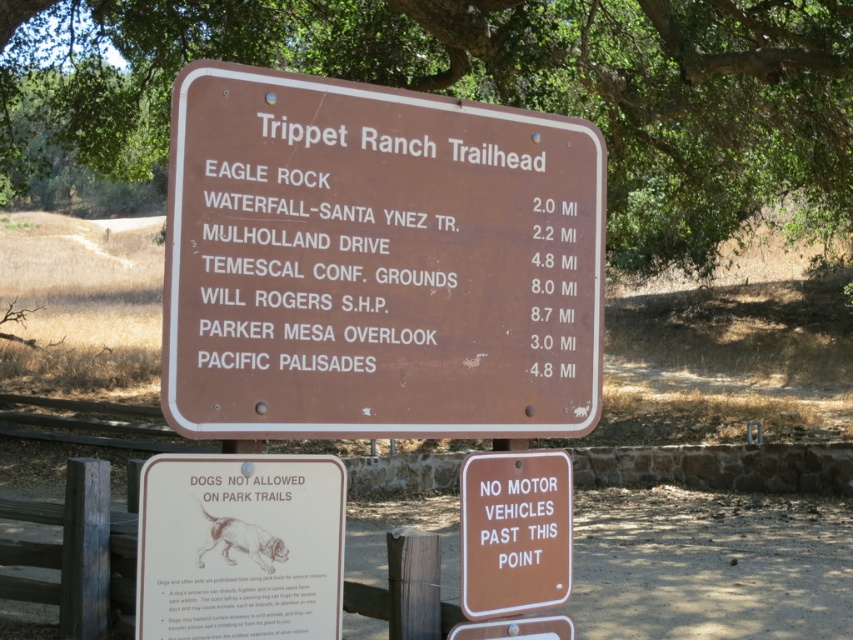
You are standing at the trailhead and want to take a photo of the matte brown sign at center. However, there is a green leafy tree at upper center in the way. Can you move to the left or right to avoid the tree while still keeping the sign in the frame?

The green leafy tree at upper center is further to the viewer than the matte brown sign at center, so moving to the left or right might allow you to position yourself so the tree is no longer blocking the sign while keeping the sign in the frame.